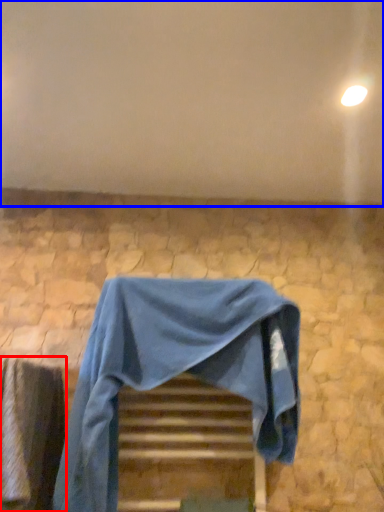
Question: Which object appears farthest to the camera in this image, curtain (highlighted by a red box) or backdrop (highlighted by a blue box)?

Choices:
 (A) curtain
 (B) backdrop

Answer: (B)